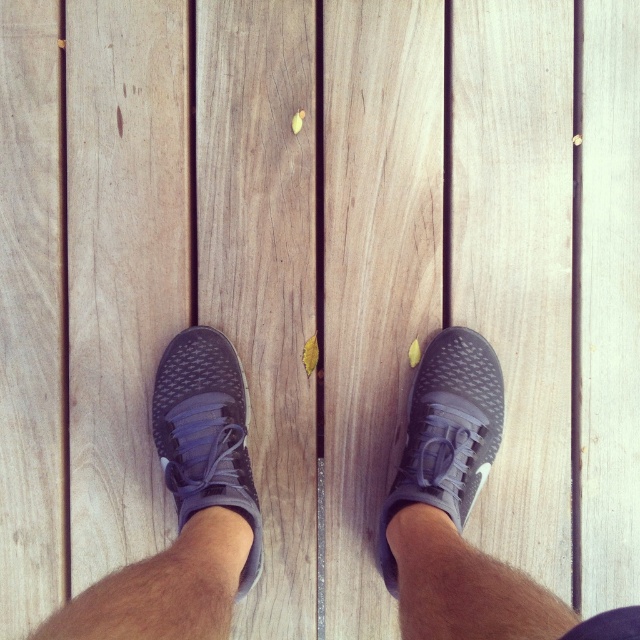
Question: Which object appears farthest from the camera in this image?

Choices:
 (A) matte gray shoe at center
 (B) matte gray sneakers at center

Answer: (A)

Question: Is matte gray sneakers at center positioned before matte gray shoe at lower left?

Choices:
 (A) no
 (B) yes

Answer: (B)

Question: Is matte gray shoe at center smaller than matte gray shoe at lower right?

Choices:
 (A) no
 (B) yes

Answer: (B)

Question: Which is nearer to the matte gray shoe at lower left?

Choices:
 (A) matte gray shoe at center
 (B) matte gray sneakers at center
 (C) matte gray shoe at lower right

Answer: (A)

Question: From the image, what is the correct spatial relationship of matte gray sneakers at center in relation to matte gray shoe at lower right?

Choices:
 (A) left
 (B) right

Answer: (B)

Question: Which point is closer to the camera taking this photo?

Choices:
 (A) (196, 390)
 (B) (186, 349)
 (C) (582, 621)

Answer: (C)